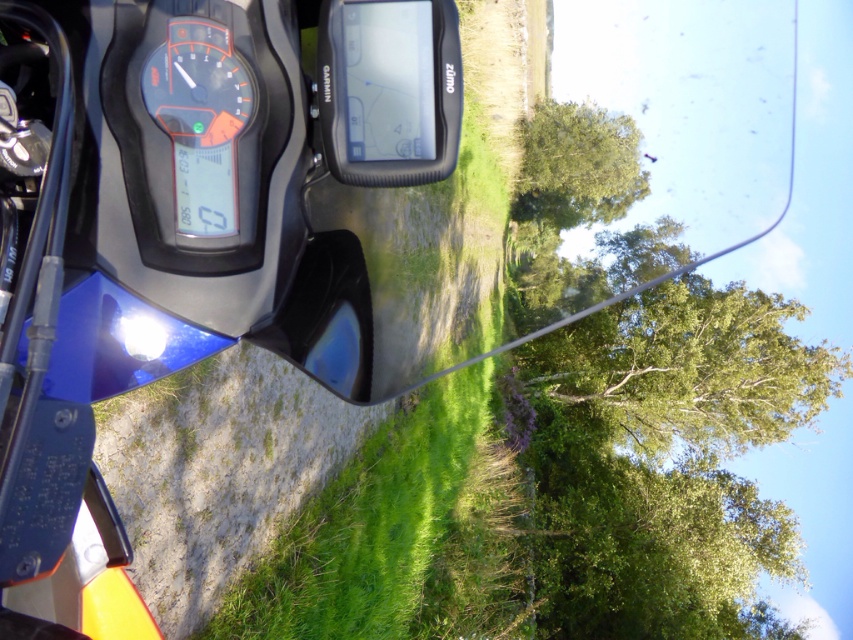
In the scene shown: You are riding a motorcycle and looking at the dashboard. You notice two points marked on the windshield. One is at coordinate point (635, 163) and the other at point (190, 24). Which point is closer to your eyes?

Point (635, 163) is further to the viewer than point (190, 24), so the point closer to your eyes is point (190, 24).

You are a rider checking your motorcycle position. The motorcycle is at point (181, 236). Where exactly is the motorcycle located in the scene?

The motorcycle is located at the center of the scene, as indicated by the coordinates point (181, 236).

You are riding a motorcycle and looking at the dashboard. You notice the green leafy tree at upper center and the orange glossy gauge at center. Which object is positioned to the right side from your viewpoint?

The green leafy tree at upper center is positioned to the right of the orange glossy gauge at center.